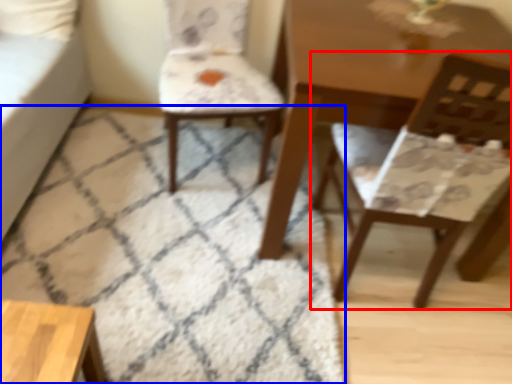
Question: Which of the following is the farthest to the observer, chair (highlighted by a red box) or mat (highlighted by a blue box)?

Choices:
 (A) chair
 (B) mat

Answer: (B)